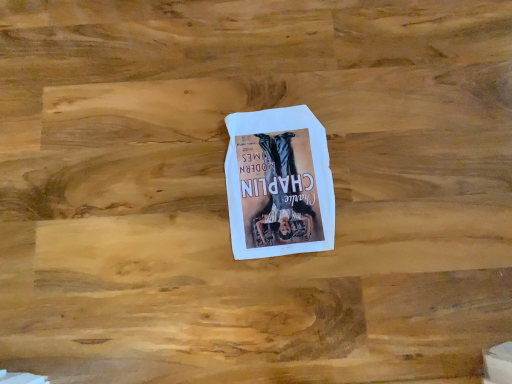
Find the location of `vacant space to the left of white paper at center`. vacant space to the left of white paper at center is located at coordinates (165, 181).